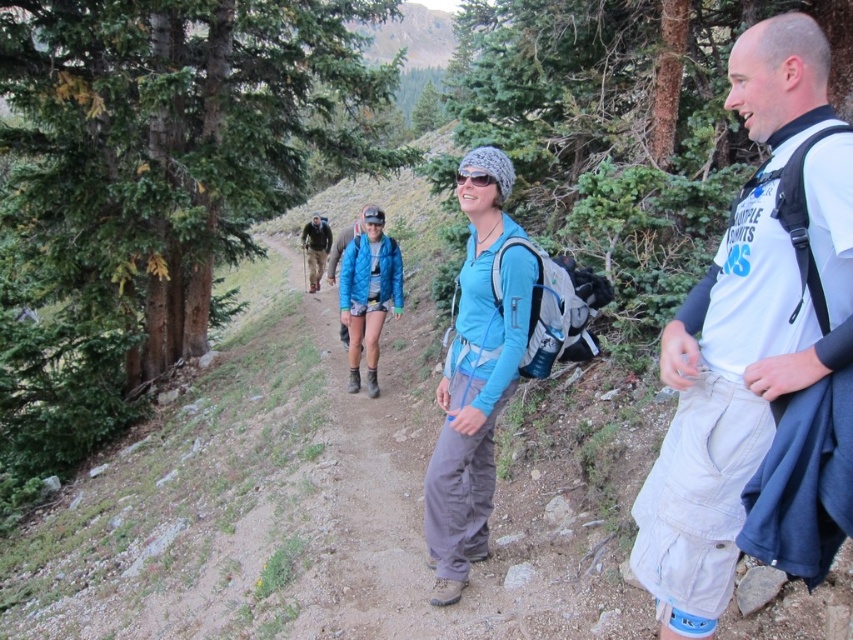
Does matte blue shirt at center have a smaller size compared to brown fabric jacket at center?

Indeed, matte blue shirt at center has a smaller size compared to brown fabric jacket at center.

Can you confirm if matte blue shirt at center is positioned above brown fabric jacket at center?

No, matte blue shirt at center is not above brown fabric jacket at center.

Where is `matte blue shirt at center`? This screenshot has width=853, height=640. matte blue shirt at center is located at coordinates (474, 374).

Based on the photo, is white cotton t-shirt at center bigger than brown fabric jacket at center?

Incorrect, white cotton t-shirt at center is not larger than brown fabric jacket at center.

Is point (831, 232) farther from camera compared to point (314, 218)?

No.

Which is behind, point (804, 24) or point (318, 250)?

Positioned behind is point (318, 250).

Where is `white cotton t-shirt at center`? This screenshot has height=640, width=853. white cotton t-shirt at center is located at coordinates (720, 413).

Which is in front, point (809, 128) or point (465, 474)?

Point (809, 128) is more forward.

Which is more to the right, white cotton t-shirt at center or matte blue shirt at center?

white cotton t-shirt at center

Identify the location of white cotton t-shirt at center. The image size is (853, 640). (720, 413).

Locate an element on the screen. The width and height of the screenshot is (853, 640). white cotton t-shirt at center is located at coordinates (720, 413).